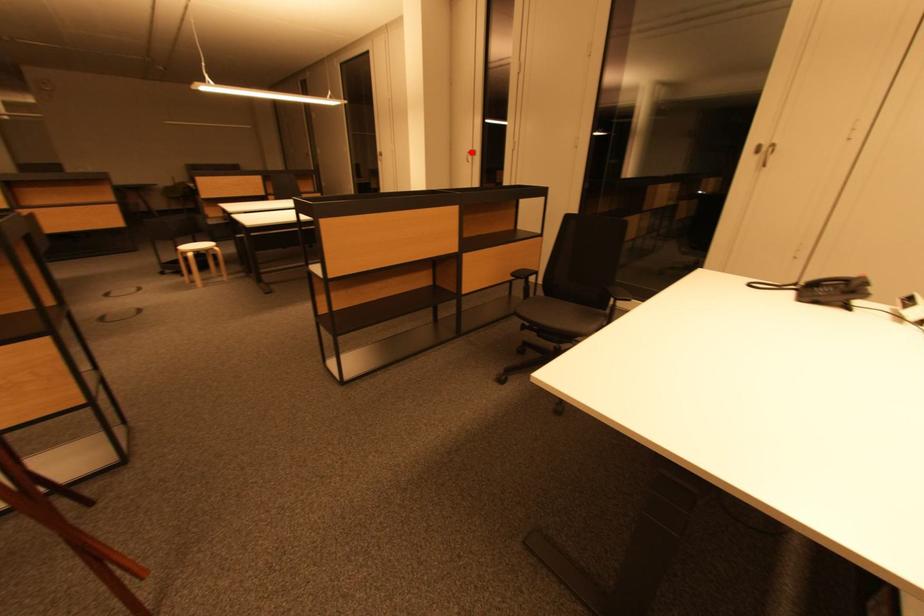
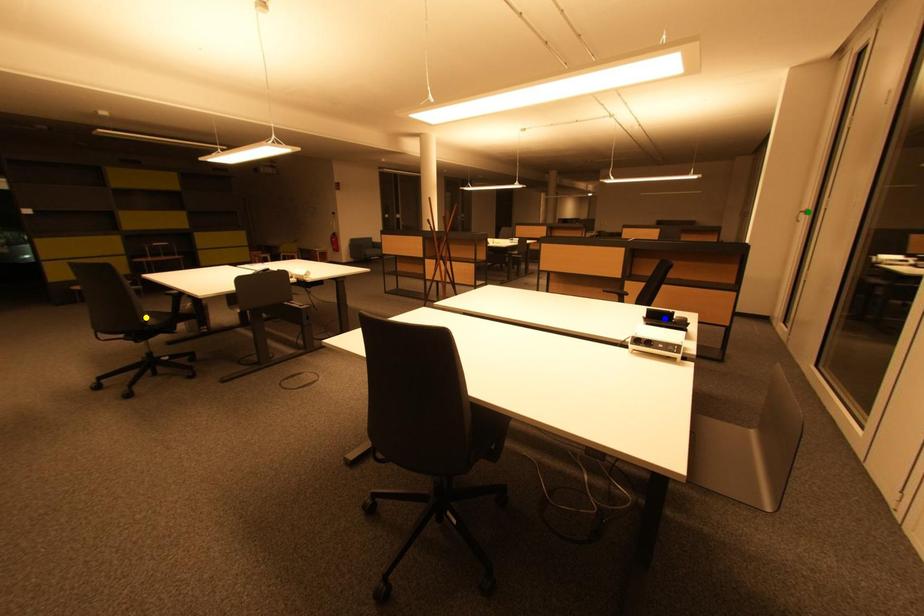
Question: I am providing you with two images of the same scene from different viewpoints. A red point is marked on the first image. You are given multiple points on the second image. Which mark in image 2 goes with the point in image 1?

Choices:
 (A) blue point
 (B) green point
 (C) yellow point

Answer: (B)